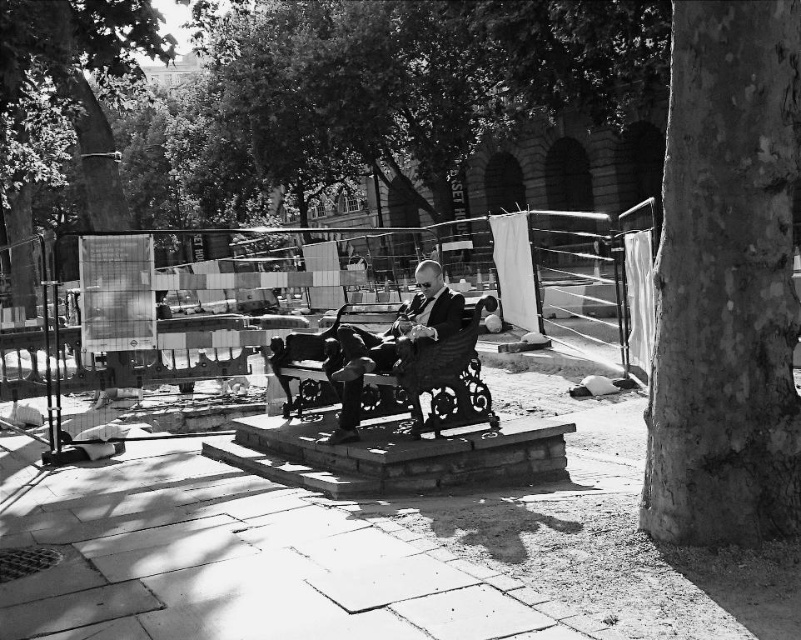
You are a construction worker standing at the edge of the construction area. You need to place a 10 feet long wooden plank between the smooth bark tree trunk at right and your current position. Is this possible?

The distance between the smooth bark tree trunk at right and the viewer is 12.97 feet, so placing a 10 feet long wooden plank between them is possible since the plank is shorter than the distance.

You are a pedestrian walking from the left side of the park towards the construction area. Which object will you encounter first as you approach the center of the scene? The smooth bark tree trunk at right or the smooth black suit at center?

The smooth black suit at center will be encountered first since it is positioned closer to the center of the scene compared to the smooth bark tree trunk at right, which is further to the right.

You are a city planner analyzing the park layout. You need to determine if the smooth bark tree trunk at right can fit through a narrow pathway that is designed to accommodate objects no wider than the smooth black suit at center. Based on the scene, can the tree trunk pass through the pathway?

The smooth bark tree trunk at right has a lesser width compared to the smooth black suit at center. Since the pathway is designed to accommodate objects no wider than the smooth black suit at center, the tree trunk can pass through the pathway as it is narrower than the allowed width.